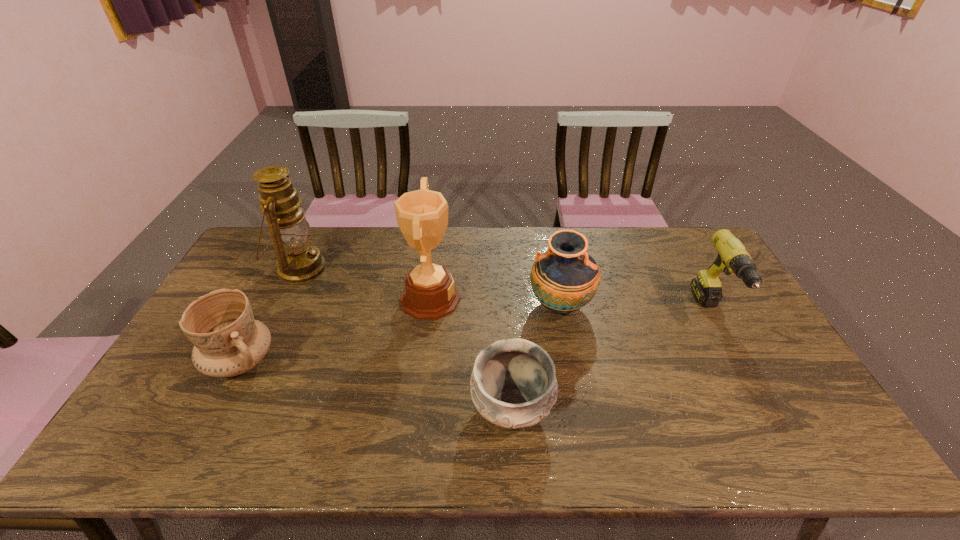
Image resolution: width=960 pixels, height=540 pixels. I want to click on free space that satisfies the following two spatial constraints: 1. on the front-facing side of the farthest pottery; 2. on the left side of the third object from left to right, so click(429, 306).